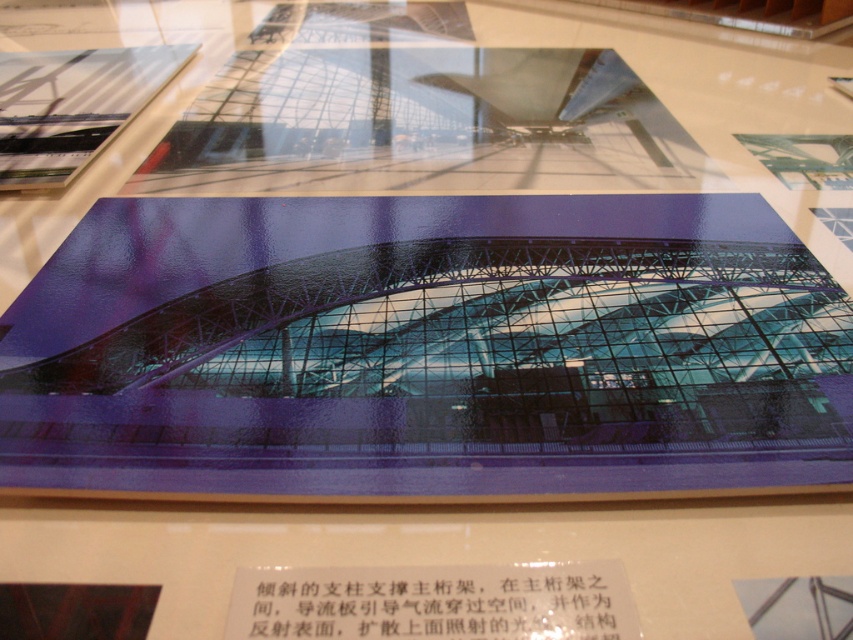
Question: Which of the following is the closest to the observer?

Choices:
 (A) (497, 595)
 (B) (0, 60)

Answer: (A)

Question: Can you confirm if white paper at center is thinner than transparent glass structure at upper left?

Choices:
 (A) no
 (B) yes

Answer: (B)

Question: Among these points, which one is farthest from the camera?

Choices:
 (A) (543, 564)
 (B) (59, 88)

Answer: (B)

Question: Is white paper at center positioned behind transparent glass structure at upper left?

Choices:
 (A) yes
 (B) no

Answer: (B)

Question: Is white paper at center thinner than transparent glass structure at upper left?

Choices:
 (A) no
 (B) yes

Answer: (B)

Question: Which of the following is the closest to the observer?

Choices:
 (A) (590, 609)
 (B) (44, 61)

Answer: (A)